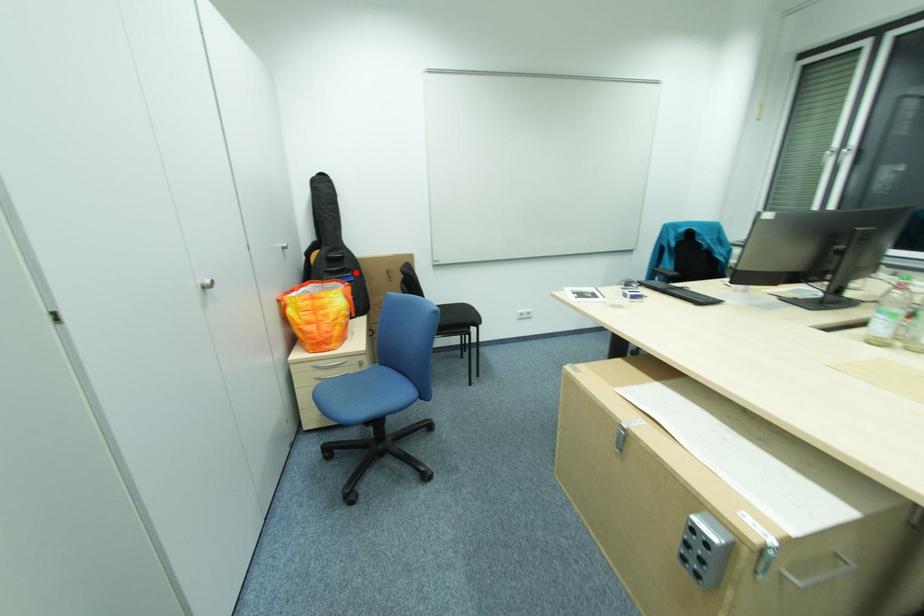
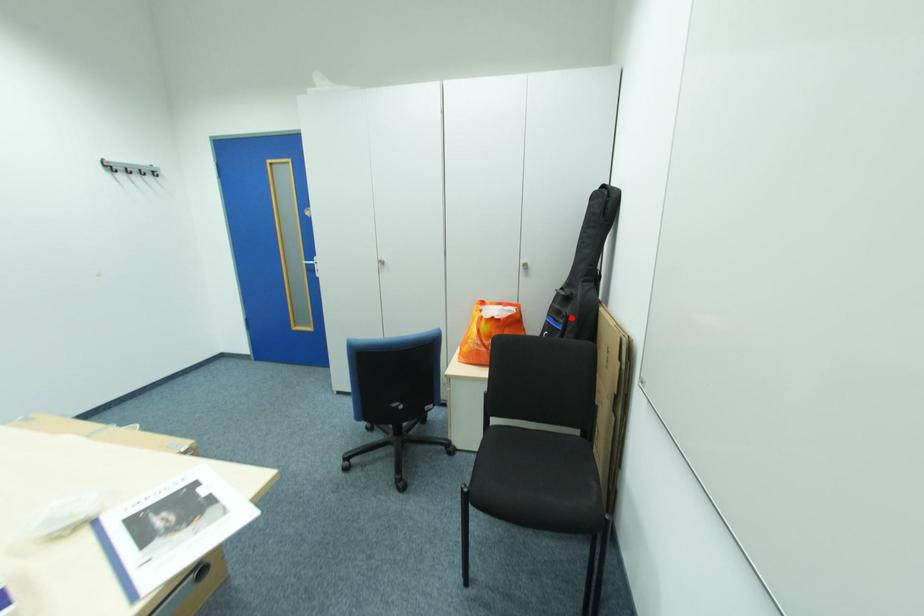
I am providing you with two images of the same scene from different viewpoints. A red point is marked on the first image and another point is marked on the second image. Does the point marked in image1 correspond to the same location as the one in image2?

Yes